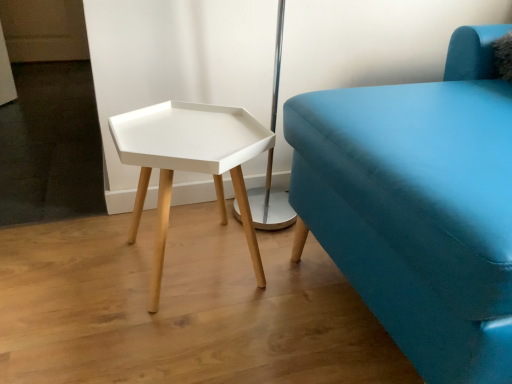
Question: Can you confirm if white matte hexagonal table at center is taller than matte blue fabric couch at right?

Choices:
 (A) yes
 (B) no

Answer: (B)

Question: From a real-world perspective, is white matte hexagonal table at center below matte blue fabric couch at right?

Choices:
 (A) no
 (B) yes

Answer: (B)

Question: Is white matte hexagonal table at center behind matte blue fabric couch at right?

Choices:
 (A) yes
 (B) no

Answer: (A)

Question: Considering the relative sizes of white matte hexagonal table at center and matte blue fabric couch at right in the image provided, is white matte hexagonal table at center bigger than matte blue fabric couch at right?

Choices:
 (A) yes
 (B) no

Answer: (B)

Question: From the image's perspective, is white matte hexagonal table at center below matte blue fabric couch at right?

Choices:
 (A) yes
 (B) no

Answer: (A)

Question: Considering the relative positions of white matte hexagonal table at center and matte blue fabric couch at right in the image provided, is white matte hexagonal table at center to the right of matte blue fabric couch at right from the viewer's perspective?

Choices:
 (A) no
 (B) yes

Answer: (A)

Question: Does matte blue fabric couch at right appear on the left side of white matte hexagonal table at center?

Choices:
 (A) yes
 (B) no

Answer: (B)

Question: From the image's perspective, is matte blue fabric couch at right beneath white matte hexagonal table at center?

Choices:
 (A) yes
 (B) no

Answer: (B)

Question: Is matte blue fabric couch at right oriented towards white matte hexagonal table at center?

Choices:
 (A) no
 (B) yes

Answer: (B)

Question: Is matte blue fabric couch at right surrounding white matte hexagonal table at center?

Choices:
 (A) no
 (B) yes

Answer: (A)

Question: Considering the relative positions of matte blue fabric couch at right and white matte hexagonal table at center in the image provided, is matte blue fabric couch at right to the right of white matte hexagonal table at center from the viewer's perspective?

Choices:
 (A) yes
 (B) no

Answer: (A)

Question: Can you confirm if matte blue fabric couch at right is wider than white matte hexagonal table at center?

Choices:
 (A) yes
 (B) no

Answer: (A)

Question: Considering their positions, is white matte hexagonal table at center located in front of or behind matte blue fabric couch at right?

Choices:
 (A) behind
 (B) front

Answer: (A)